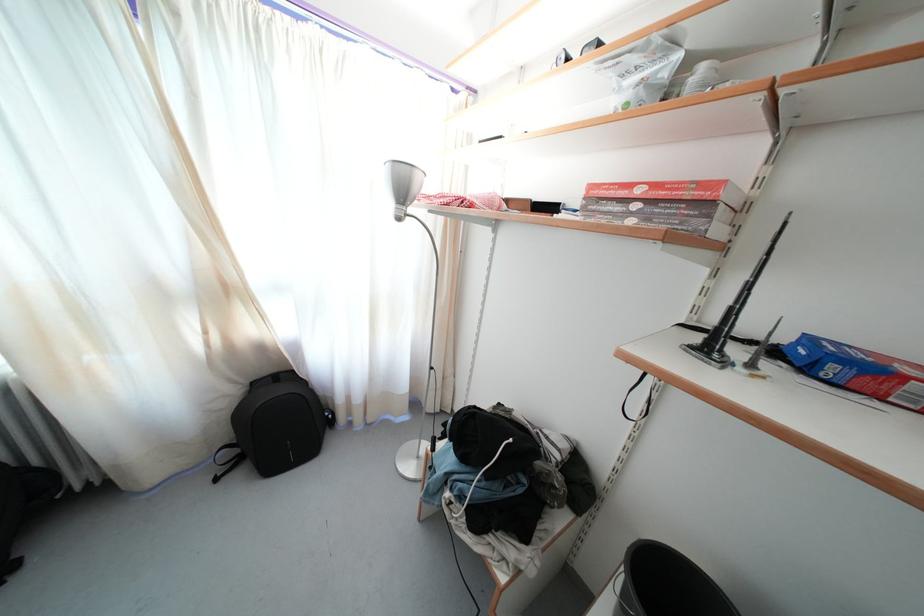
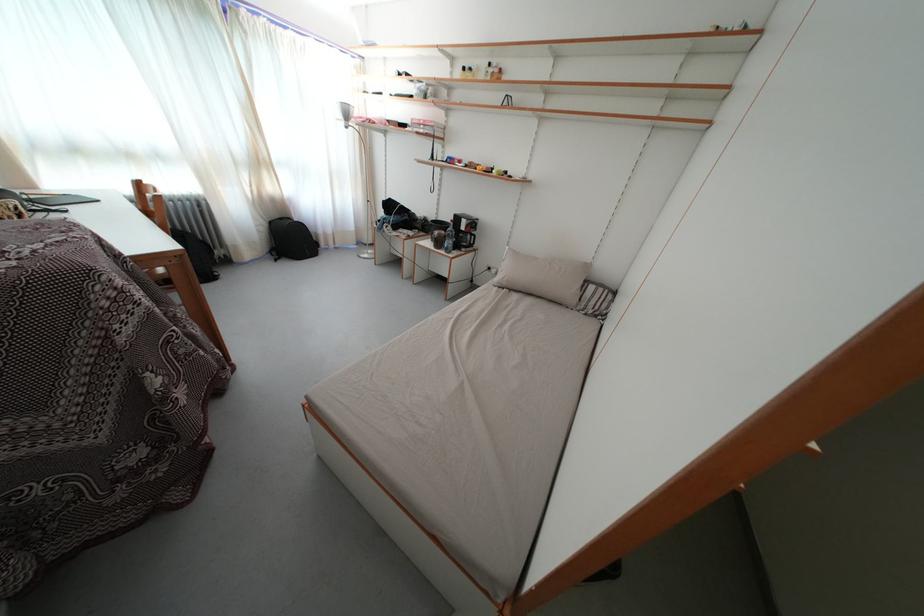
The point at (238, 399) is marked in the first image. Where is the corresponding point in the second image?

(272, 230)